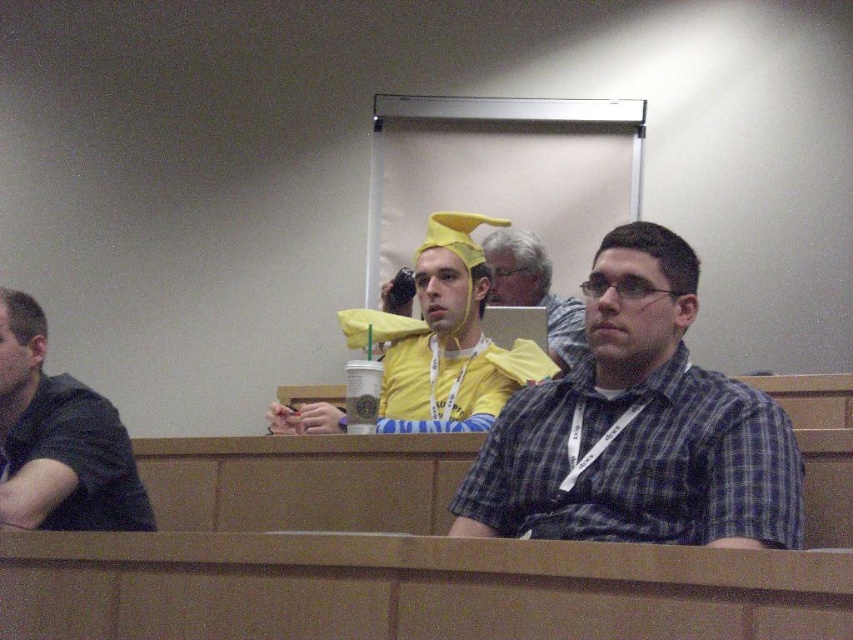
Question: Which of the following is the closest to the observer?

Choices:
 (A) (561, 358)
 (B) (26, 296)

Answer: (B)

Question: Can you confirm if yellow matte banana at center is thinner than dark gray shirt at left?

Choices:
 (A) yes
 (B) no

Answer: (B)

Question: Which of these objects is positioned farthest from the plaid shirt at center?

Choices:
 (A) dark gray shirt at left
 (B) yellow fabric hat at center
 (C) yellow matte banana at center

Answer: (B)

Question: Estimate the real-world distances between objects in this image. Which object is farther from the yellow matte banana at center?

Choices:
 (A) yellow fabric hat at center
 (B) plaid shirt at center

Answer: (A)

Question: Can you confirm if dark gray shirt at left is positioned below yellow fabric hat at center?

Choices:
 (A) no
 (B) yes

Answer: (B)

Question: Is yellow matte banana at center to the right of dark gray shirt at left from the viewer's perspective?

Choices:
 (A) yes
 (B) no

Answer: (A)